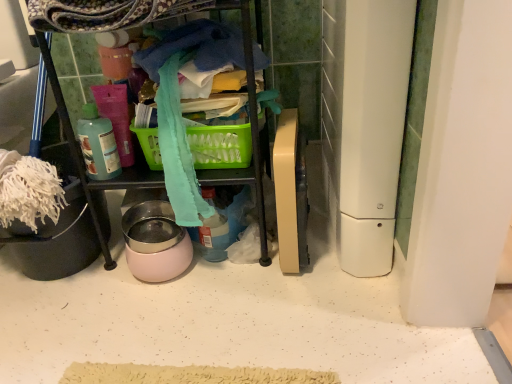
Question: From the image's perspective, is green plastic picnic basket at center above or below white plastic appliance at right, the 1th appliance when ordered from right to left?

Choices:
 (A) below
 (B) above

Answer: (A)

Question: Choose the correct answer: Is green plastic picnic basket at center inside white plastic appliance at right, the 2th appliance from the left, or outside it?

Choices:
 (A) inside
 (B) outside

Answer: (B)

Question: Estimate the real-world distances between objects in this image. Which object is farther from the white plastic appliance at right, the 1th appliance when ordered from right to left?

Choices:
 (A) pink glossy bowl at center, arranged as the 2th appliance when viewed from the right
 (B) green plastic picnic basket at center
 (C) translucent plastic bottle at upper left

Answer: (C)

Question: Which of these objects is positioned farthest from the pink glossy bowl at center, the first appliance when ordered from left to right?

Choices:
 (A) translucent plastic bottle at upper left
 (B) green plastic picnic basket at center
 (C) white plastic appliance at right, the 2th appliance from the left

Answer: (C)